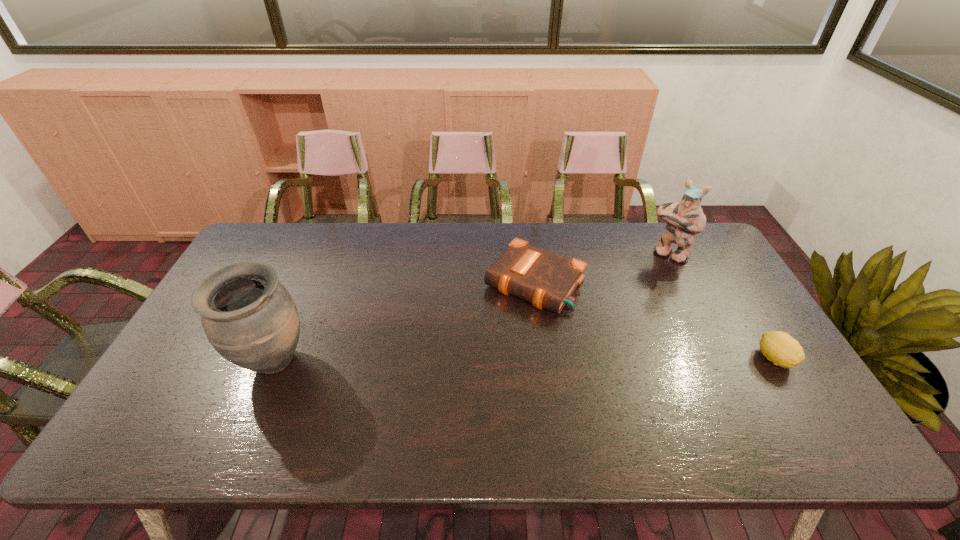
Where is `free space located 0.120m on the front-facing side of the figurine`? This screenshot has width=960, height=540. free space located 0.120m on the front-facing side of the figurine is located at coordinates (645, 281).

This screenshot has height=540, width=960. Identify the location of vacant position located on the front-facing side of the figurine. (608, 327).

This screenshot has height=540, width=960. What are the coordinates of `Bible at the far edge` in the screenshot? It's located at (547, 280).

The height and width of the screenshot is (540, 960). Find the location of `figurine that is at the far edge`. figurine that is at the far edge is located at coordinates (684, 219).

In order to click on object situated at the near edge in this screenshot , I will do `click(249, 317)`.

Identify the location of lemon that is at the right edge. Image resolution: width=960 pixels, height=540 pixels. (780, 348).

Identify the location of figurine located in the right edge section of the desktop. This screenshot has width=960, height=540. (684, 219).

You are a GUI agent. You are given a task and a screenshot of the screen. Output one action in this format:
    pyautogui.click(x=<x>, y=<y>)
    Task: Click on the object positioned at the far right corner
    
    Given the screenshot: What is the action you would take?
    pyautogui.click(x=684, y=219)

The height and width of the screenshot is (540, 960). I want to click on vacant space at the far edge of the desktop, so click(342, 231).

You are a GUI agent. You are given a task and a screenshot of the screen. Output one action in this format:
    pyautogui.click(x=<x>, y=<y>)
    Task: Click on the vacant space at the near edge of the desktop
    
    Given the screenshot: What is the action you would take?
    pyautogui.click(x=653, y=393)